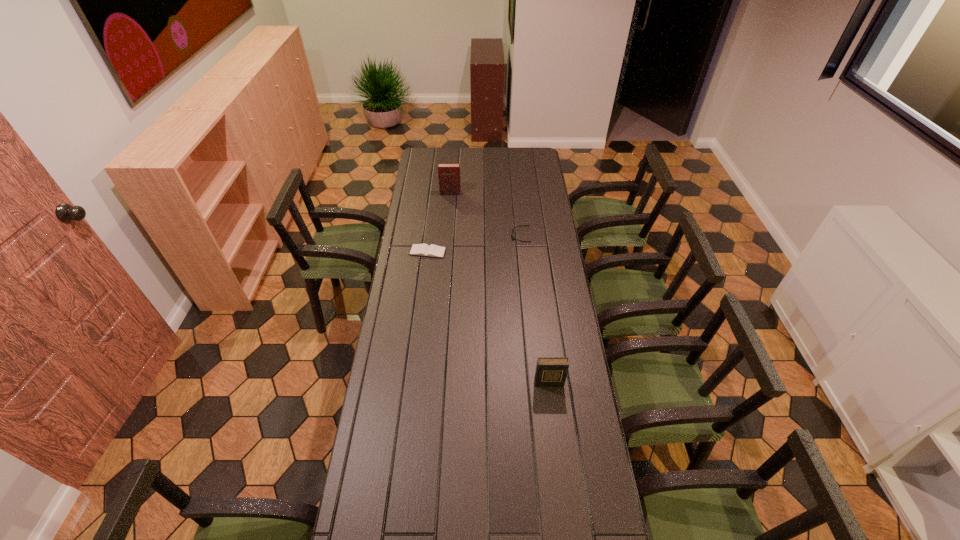
Locate which object is the closest to the sunglasses. Please provide its 2D coordinates. Your answer should be formatted as a tuple, i.e. [(x, y)], where the tuple contains the x and y coordinates of a point satisfying the conditions above.

[(425, 250)]

This screenshot has height=540, width=960. In order to click on object that is the second closest to the farthest object in this screenshot , I will do `click(425, 250)`.

The width and height of the screenshot is (960, 540). Identify the location of diary that is the second closest one to the third farthest object. (550, 371).

Identify which diary is located as the nearest to the second tallest object. Please provide its 2D coordinates. Your answer should be formatted as a tuple, i.e. [(x, y)], where the tuple contains the x and y coordinates of a point satisfying the conditions above.

[(425, 250)]

Identify the location of free space that satisfies the following two spatial constraints: 1. on the front-facing side of the second farthest object; 2. on the front side of the second farthest diary. This screenshot has width=960, height=540. (522, 252).